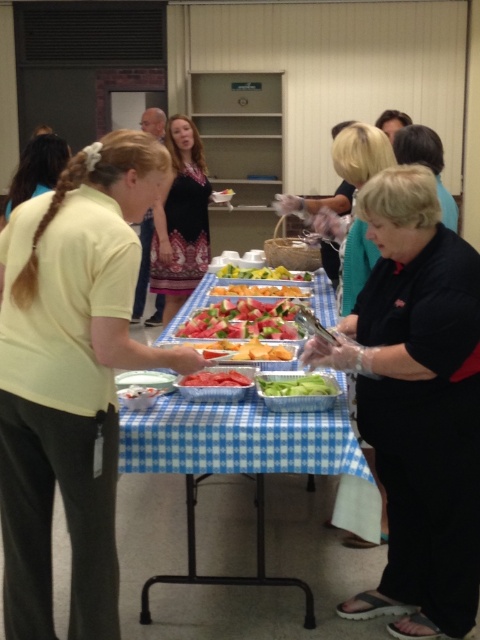
The image size is (480, 640). Describe the element at coordinates (418, 404) in the screenshot. I see `black matte shirt at center` at that location.

Is black matte shirt at center positioned behind red matte watermelon at center?

No, black matte shirt at center is in front of red matte watermelon at center.

Is point (395, 602) positioned behind point (195, 384)?

Yes, it is behind point (195, 384).

Where is `black matte shirt at center`? The width and height of the screenshot is (480, 640). black matte shirt at center is located at coordinates (418, 404).

Who is shorter, black matte shirt at center or green matte celery at center?

With less height is green matte celery at center.

Can you confirm if black matte shirt at center is positioned to the left of green matte celery at center?

No, black matte shirt at center is not to the left of green matte celery at center.

Is point (433, 275) closer to camera compared to point (302, 376)?

Yes, point (433, 275) is in front of point (302, 376).

Where is `black matte shirt at center`? Image resolution: width=480 pixels, height=640 pixels. black matte shirt at center is located at coordinates (418, 404).

In the scene shown: Can you confirm if yellow matte shirt at left is smaller than green matte celery at center?

No, yellow matte shirt at left is not smaller than green matte celery at center.

Is yellow matte shirt at left behind green matte celery at center?

No, yellow matte shirt at left is in front of green matte celery at center.

Where is `yellow matte shirt at left`? yellow matte shirt at left is located at coordinates (72, 378).